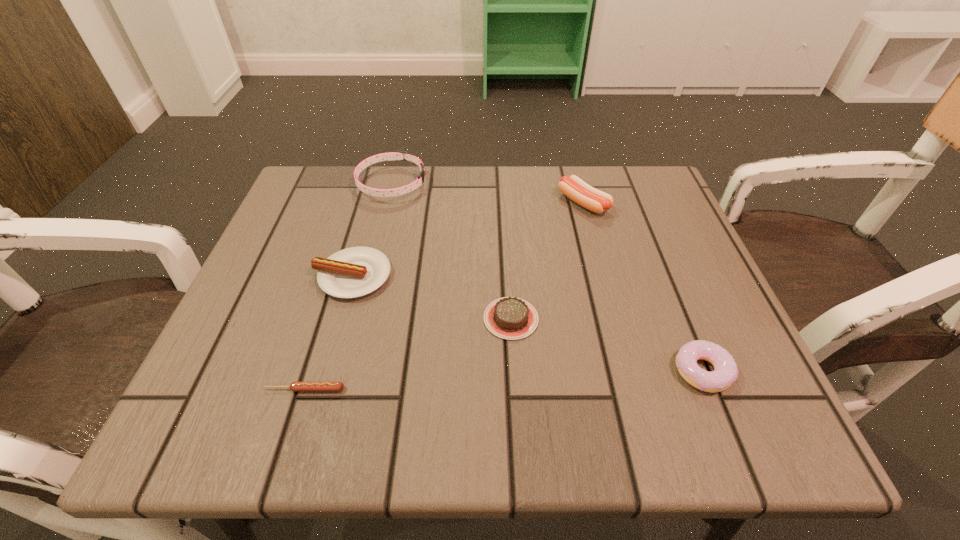
Select which object appears as the third closest to the shortest sausage. Please provide its 2D coordinates. Your answer should be formatted as a tuple, i.e. [(x, y)], where the tuple contains the x and y coordinates of a point satisfying the conditions above.

[(397, 154)]

Locate an element on the screen. The image size is (960, 540). the second closest object relative to the shortest object is located at coordinates (511, 318).

Find the location of a particular element. The height and width of the screenshot is (540, 960). the closest sausage to the rightmost object is located at coordinates (573, 187).

Point out which sausage is positioned as the nearest to the second farthest sausage. Please provide its 2D coordinates. Your answer should be formatted as a tuple, i.e. [(x, y)], where the tuple contains the x and y coordinates of a point satisfying the conditions above.

[(294, 386)]

Identify the location of free space that satisfies the following two spatial constraints: 1. with the buckle on the dog collar; 2. on the front side of the second farthest sausage. (369, 276).

At what (x,y) coordinates should I click in order to perform the action: click on vacant point that satisfies the following two spatial constraints: 1. with the buckle on the dog collar; 2. on the back side of the rightmost sausage. Please return your answer as a coordinate pair (x, y). Looking at the image, I should click on (387, 203).

This screenshot has height=540, width=960. In order to click on vacant area in the image that satisfies the following two spatial constraints: 1. on the front side of the doughnut; 2. on the right side of the second nearest sausage in this screenshot , I will do `click(325, 371)`.

Identify the location of free spot that satisfies the following two spatial constraints: 1. with the buckle on the dog collar; 2. on the back side of the tallest sausage. Image resolution: width=960 pixels, height=540 pixels. 387,203.

Locate an element on the screen. This screenshot has width=960, height=540. vacant position in the image that satisfies the following two spatial constraints: 1. on the back side of the fourth object from left to right; 2. with the buckle on the dog collar is located at coordinates (502, 184).

Image resolution: width=960 pixels, height=540 pixels. I want to click on free spot that satisfies the following two spatial constraints: 1. with the buckle on the dog collar; 2. on the back side of the fifth tallest object, so click(x=359, y=319).